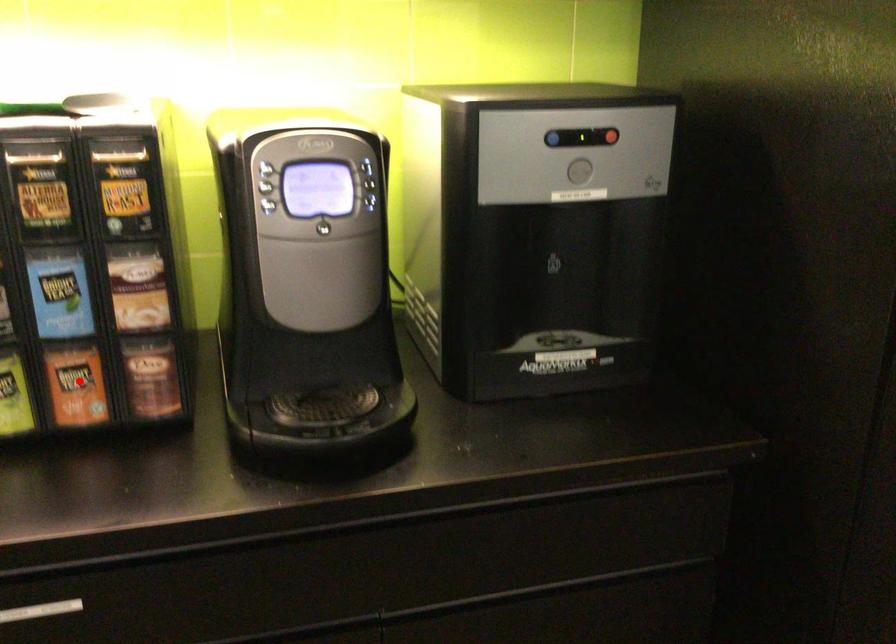
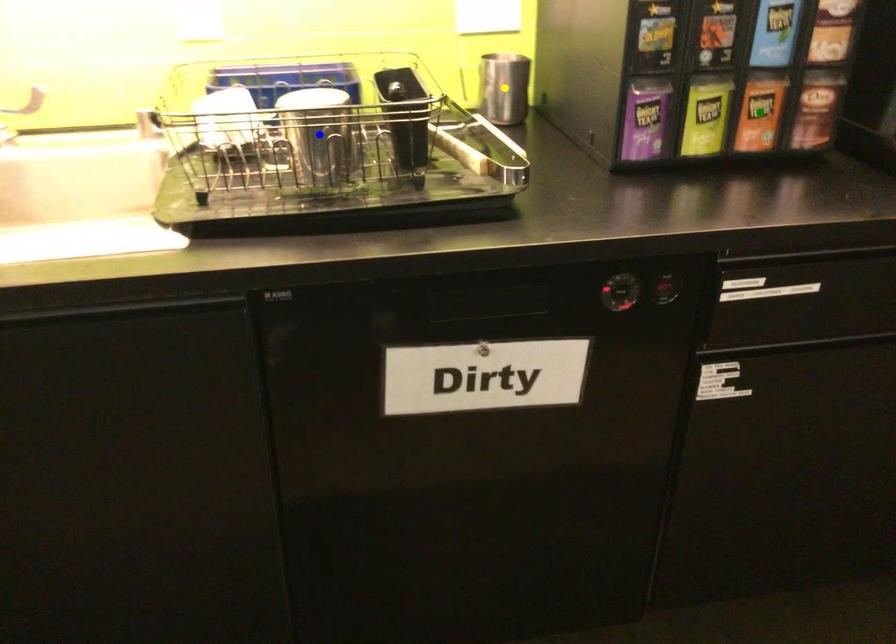
Question: I am providing you with two images of the same scene from different viewpoints. A red point is marked on the first image. You are given multiple points on the second image. Which spot in image 2 lines up with the point in image 1?

Choices:
 (A) yellow point
 (B) blue point
 (C) green point

Answer: (C)